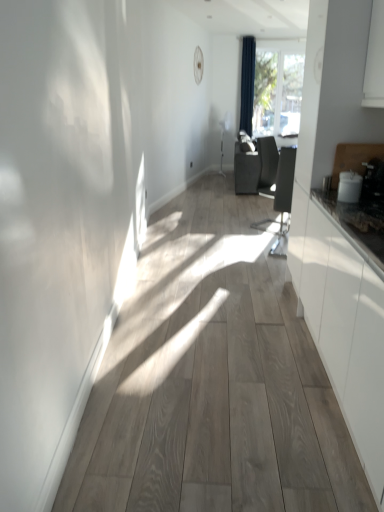
Question: Is matte black swivel chair at center looking in the opposite direction of transparent glass window at upper center?

Choices:
 (A) no
 (B) yes

Answer: (A)

Question: Does matte black swivel chair at center have a greater width compared to transparent glass window at upper center?

Choices:
 (A) no
 (B) yes

Answer: (B)

Question: Does matte black swivel chair at center have a lesser height compared to transparent glass window at upper center?

Choices:
 (A) yes
 (B) no

Answer: (A)

Question: From a real-world perspective, is matte black swivel chair at center below transparent glass window at upper center?

Choices:
 (A) no
 (B) yes

Answer: (B)

Question: Is matte black swivel chair at center next to transparent glass window at upper center?

Choices:
 (A) no
 (B) yes

Answer: (A)

Question: Is dark blue fabric curtain at upper center in front of or behind matte black swivel chair at center in the image?

Choices:
 (A) front
 (B) behind

Answer: (B)

Question: From a real-world perspective, is dark blue fabric curtain at upper center positioned above or below matte black swivel chair at center?

Choices:
 (A) above
 (B) below

Answer: (A)

Question: Looking at their shapes, would you say dark blue fabric curtain at upper center is wider or thinner than matte black swivel chair at center?

Choices:
 (A) wide
 (B) thin

Answer: (B)

Question: Is point (251, 101) closer or farther from the camera than point (291, 173)?

Choices:
 (A) closer
 (B) farther

Answer: (B)

Question: Visually, is transparent glass window at upper center positioned to the left or to the right of matte black swivel chair at center?

Choices:
 (A) right
 (B) left

Answer: (A)

Question: Looking at their shapes, would you say transparent glass window at upper center is wider or thinner than matte black swivel chair at center?

Choices:
 (A) wide
 (B) thin

Answer: (B)

Question: From their relative heights in the image, would you say transparent glass window at upper center is taller or shorter than matte black swivel chair at center?

Choices:
 (A) tall
 (B) short

Answer: (A)

Question: Considering the positions of point (258, 131) and point (279, 203), is point (258, 131) closer or farther from the camera than point (279, 203)?

Choices:
 (A) closer
 (B) farther

Answer: (B)

Question: From their relative heights in the image, would you say dark blue fabric curtain at upper center is taller or shorter than transparent glass window at upper center?

Choices:
 (A) tall
 (B) short

Answer: (A)

Question: Which is correct: dark blue fabric curtain at upper center is inside transparent glass window at upper center, or outside of it?

Choices:
 (A) outside
 (B) inside

Answer: (A)